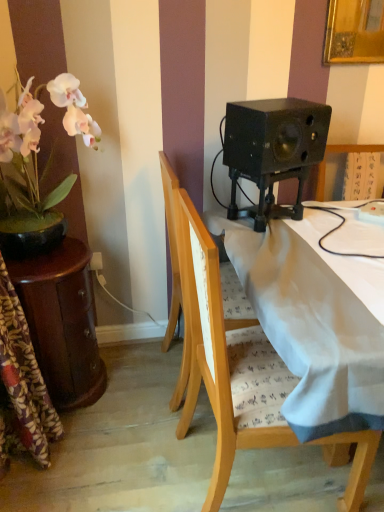
Question: Is black matte speaker at upper right oriented away from wooden chair at center, the 1th chair positioned from the front?

Choices:
 (A) no
 (B) yes

Answer: (A)

Question: Does black matte speaker at upper right have a larger size compared to wooden chair at center, the 2th chair viewed from the back?

Choices:
 (A) yes
 (B) no

Answer: (B)

Question: Considering the relative sizes of black matte speaker at upper right and wooden chair at center, the 1th chair positioned from the front, in the image provided, is black matte speaker at upper right smaller than wooden chair at center, the 1th chair positioned from the front,?

Choices:
 (A) no
 (B) yes

Answer: (B)

Question: Is black matte speaker at upper right completely or partially outside of wooden chair at center, the 1th chair positioned from the front?

Choices:
 (A) yes
 (B) no

Answer: (A)

Question: From a real-world perspective, does black matte speaker at upper right sit lower than wooden chair at center, the 1th chair positioned from the front?

Choices:
 (A) no
 (B) yes

Answer: (A)

Question: Is black matte speaker at upper right shorter than wooden chair at center, the 1th chair positioned from the front?

Choices:
 (A) no
 (B) yes

Answer: (B)

Question: From the image's perspective, is pink matte flower pot at left over black matte speaker at upper right?

Choices:
 (A) no
 (B) yes

Answer: (A)

Question: From the image's perspective, does pink matte flower pot at left appear lower than black matte speaker at upper right?

Choices:
 (A) yes
 (B) no

Answer: (A)

Question: Is pink matte flower pot at left outside of black matte speaker at upper right?

Choices:
 (A) no
 (B) yes

Answer: (B)

Question: Could you tell me if pink matte flower pot at left is turned towards black matte speaker at upper right?

Choices:
 (A) no
 (B) yes

Answer: (B)

Question: Is black matte speaker at upper right completely or partially inside pink matte flower pot at left?

Choices:
 (A) yes
 (B) no

Answer: (B)

Question: Is pink matte flower pot at left closer to camera compared to black matte speaker at upper right?

Choices:
 (A) yes
 (B) no

Answer: (A)

Question: From the image's perspective, is black matte speaker at upper right on top of mahogany wooden side table at left?

Choices:
 (A) no
 (B) yes

Answer: (B)